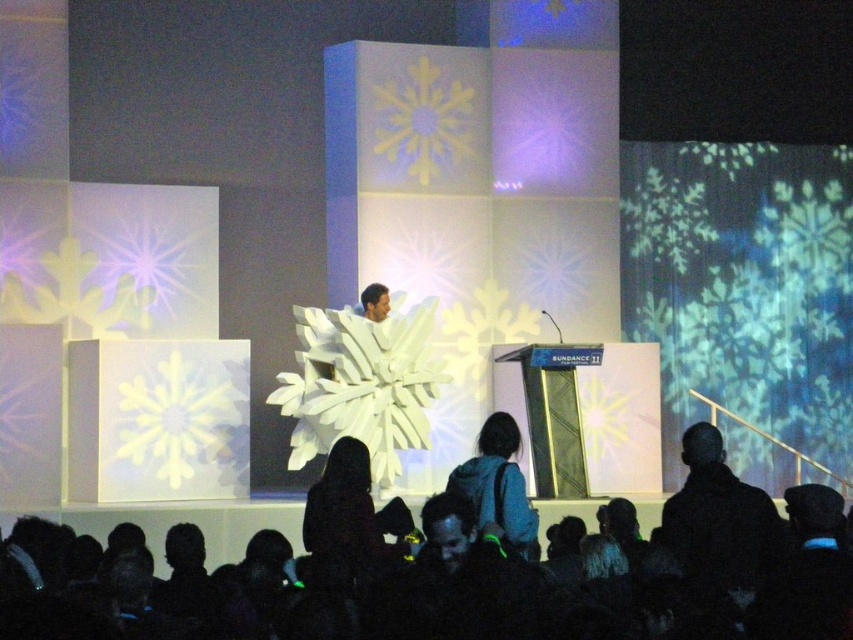
Question: Can you confirm if black fabric at lower center is smaller than black matte jacket at lower right?

Choices:
 (A) no
 (B) yes

Answer: (A)

Question: Does black fabric at lower center have a greater width compared to dark brown leather jacket at center?

Choices:
 (A) yes
 (B) no

Answer: (A)

Question: Which object is positioned closest to the black matte jacket at lower right?

Choices:
 (A) black fabric at lower center
 (B) dark brown leather jacket at center
 (C) blue backpack at center

Answer: (A)

Question: Which object is the farthest from the black fabric at lower center?

Choices:
 (A) black matte jacket at lower right
 (B) blue backpack at center
 (C) dark brown leather jacket at center

Answer: (A)

Question: Which object is positioned farthest from the black matte jacket at lower right?

Choices:
 (A) black fabric at lower center
 (B) dark brown leather jacket at center
 (C) blue backpack at center

Answer: (B)

Question: Considering the relative positions of black matte jacket at lower right and dark brown leather jacket at center in the image provided, where is black matte jacket at lower right located with respect to dark brown leather jacket at center?

Choices:
 (A) below
 (B) above

Answer: (B)